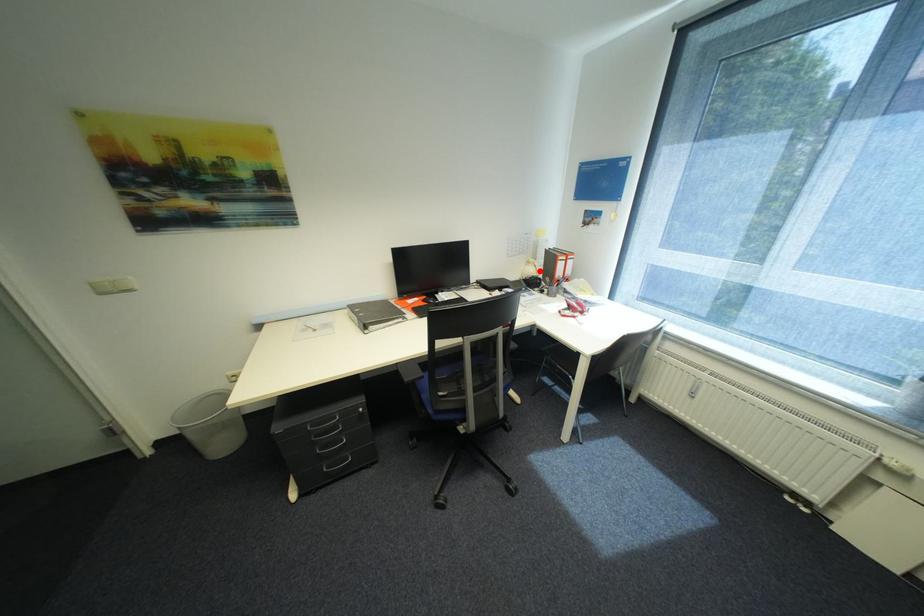
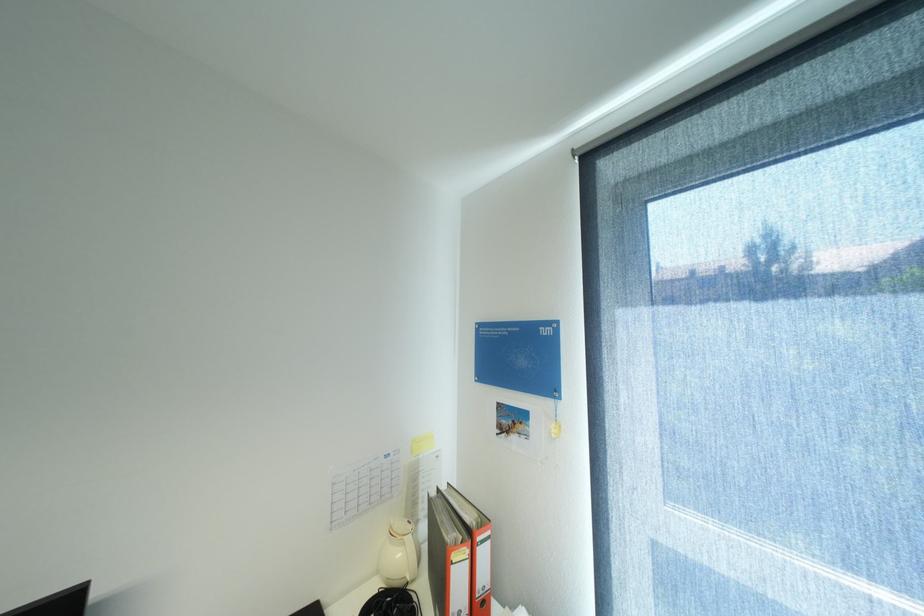
In the second image, find the point that corresponds to the highlighted location in the first image.

(407, 554)